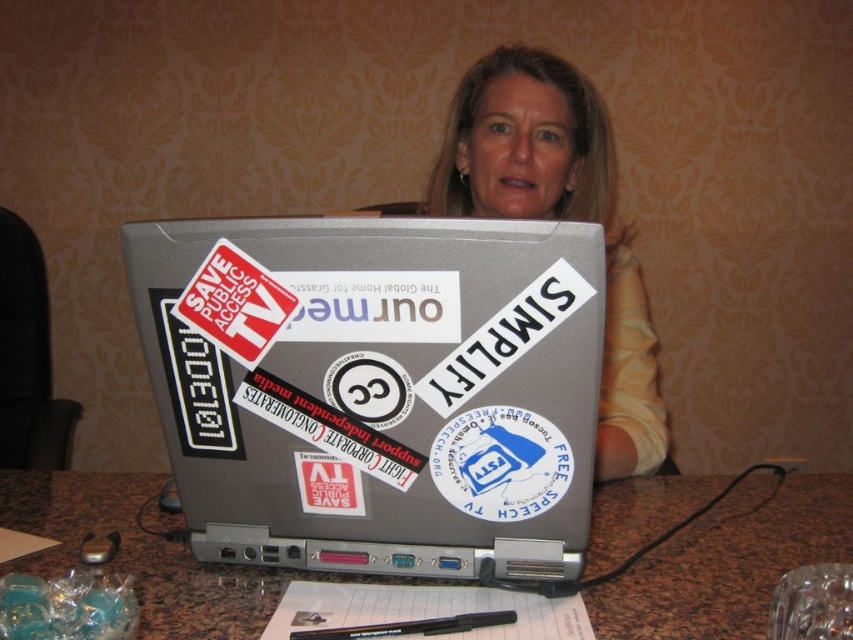
Question: Is silver/stainless steel laptop at center to the right of blonde hair at center from the viewer's perspective?

Choices:
 (A) no
 (B) yes

Answer: (A)

Question: Which object appears closest to the camera in this image?

Choices:
 (A) red paper sticker at center
 (B) marble table at lower center
 (C) white paper sticker at center
 (D) silver/stainless steel laptop at center

Answer: (D)

Question: Which point is farther to the camera?

Choices:
 (A) white paper sticker at center
 (B) black plastic pen at center
 (C) silver/stainless steel laptop at center
 (D) blonde hair at center

Answer: (D)

Question: Which object is positioned closest to the black plastic pen at center?

Choices:
 (A) marble table at lower center
 (B) blonde hair at center
 (C) red paper sticker at center
 (D) white paper sticker at center

Answer: (D)

Question: Is marble table at lower center bigger than red paper sticker at center?

Choices:
 (A) no
 (B) yes

Answer: (B)

Question: Can you confirm if marble table at lower center is positioned above black plastic pen at center?

Choices:
 (A) no
 (B) yes

Answer: (B)